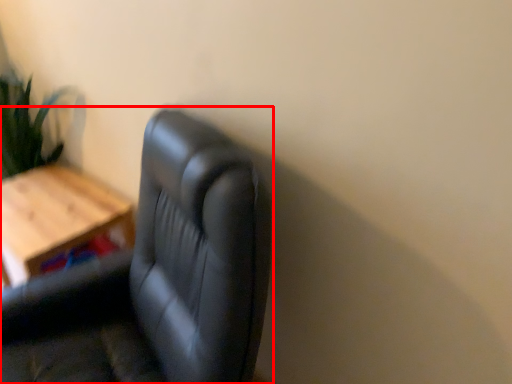
Question: From the image's perspective, where is chair (annotated by the red box) located in relation to table in the image?

Choices:
 (A) above
 (B) below

Answer: (B)